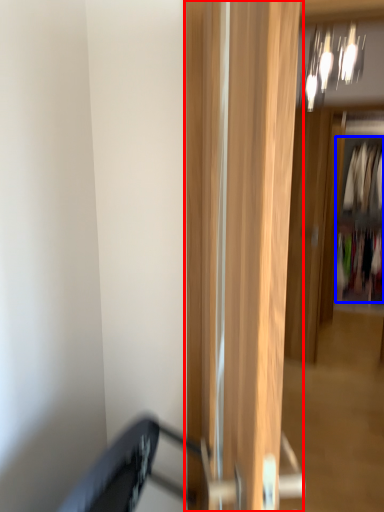
Question: Which of the following is the closest to the observer, door (highlighted by a red box) or clothing (highlighted by a blue box)?

Choices:
 (A) door
 (B) clothing

Answer: (A)